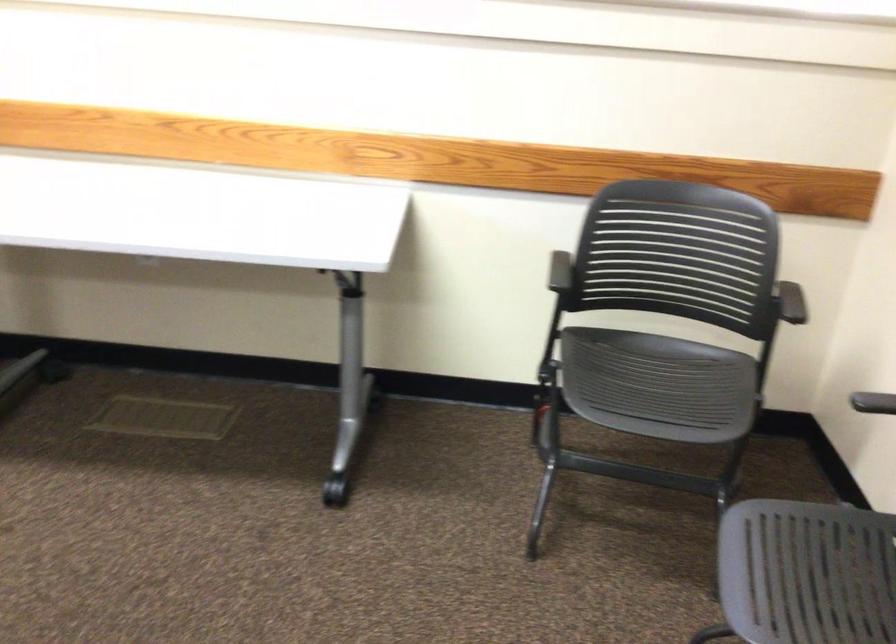
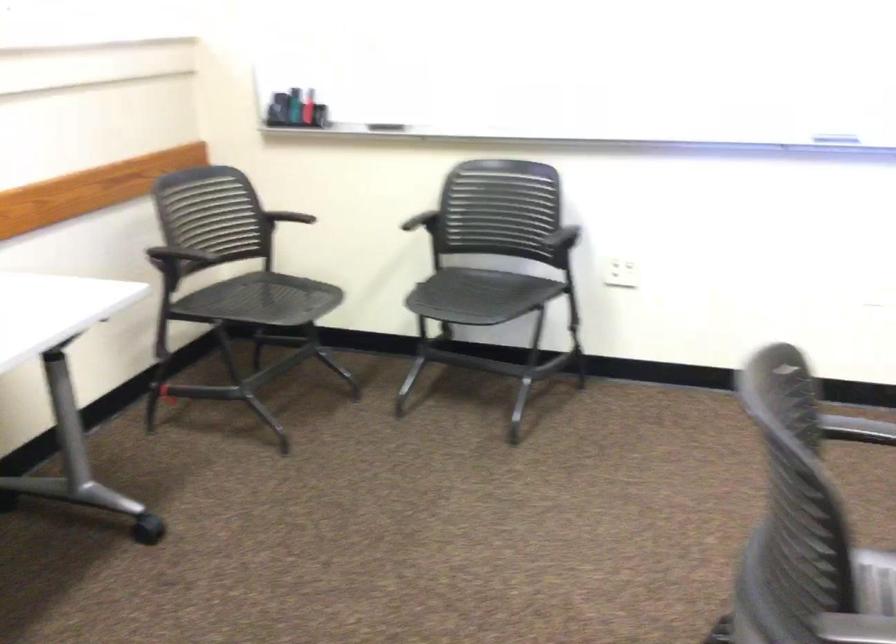
Find the pixel in the second image that matches pixel 873 402 in the first image.

(419, 223)